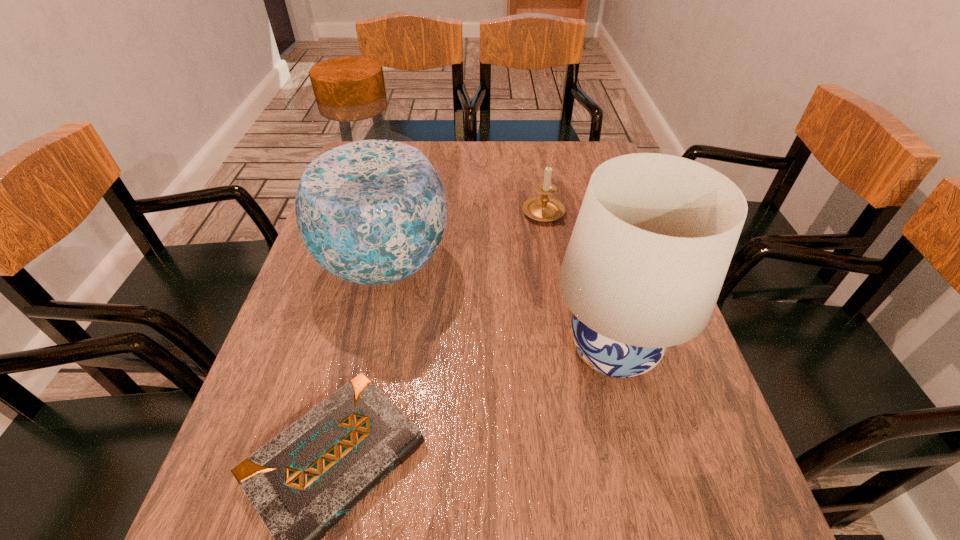
Locate an element on the screen. This screenshot has height=540, width=960. the tallest object is located at coordinates (370, 207).

Locate an element on the screen. Image resolution: width=960 pixels, height=540 pixels. lampshade is located at coordinates (655, 234).

You are a GUI agent. You are given a task and a screenshot of the screen. Output one action in this format:
    pyautogui.click(x=<x>, y=<y>)
    Task: Click on the second shortest object
    This screenshot has height=540, width=960.
    Given the screenshot: What is the action you would take?
    pyautogui.click(x=541, y=208)

At what (x,y) coordinates should I click in order to perform the action: click on free space located on the front of the water jug. Please return your answer as a coordinate pair (x, y). Looking at the image, I should click on (336, 482).

I want to click on vacant space located on the front-facing side of the lampshade, so click(x=387, y=350).

In order to click on vacant space located 0.260m on the front-facing side of the lampshade in this screenshot , I will do `click(421, 350)`.

Where is `free space located on the front-facing side of the lampshade`? Image resolution: width=960 pixels, height=540 pixels. free space located on the front-facing side of the lampshade is located at coordinates coord(431,350).

You are a GUI agent. You are given a task and a screenshot of the screen. Output one action in this format:
    pyautogui.click(x=<x>, y=<y>)
    Task: Click on the blank space located with a handle on the side of the candle holder
    
    Given the screenshot: What is the action you would take?
    pyautogui.click(x=535, y=160)

Find the location of a particular element. vacant area situated with a handle on the side of the candle holder is located at coordinates (536, 165).

Identify the location of vacant region located 0.170m with a handle on the side of the candle holder. (536, 165).